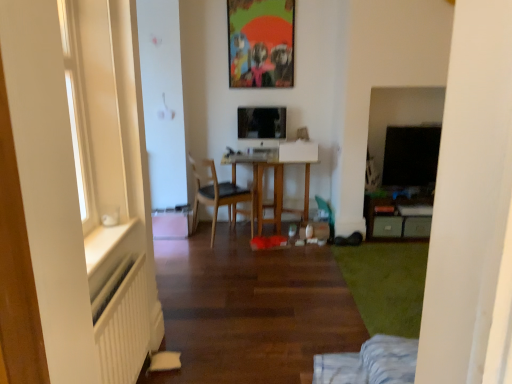
Question: Is matte plastic picture frame at upper center bigger or smaller than black glossy tv at right?

Choices:
 (A) big
 (B) small

Answer: (A)

Question: Considering the relative positions of matte plastic picture frame at upper center and black glossy tv at right in the image provided, is matte plastic picture frame at upper center to the left or to the right of black glossy tv at right?

Choices:
 (A) left
 (B) right

Answer: (A)

Question: Considering the real-world distances, which object is farthest from the matte plastic picture frame at upper center?

Choices:
 (A) wooden chair at center
 (B) wooden table at center
 (C) black glossy tv at right
 (D) white ribbed radiator at lower left

Answer: (D)

Question: Which object is the farthest from the black glossy tv at right?

Choices:
 (A) white ribbed radiator at lower left
 (B) matte plastic picture frame at upper center
 (C) wooden table at center
 (D) wooden chair at center

Answer: (A)